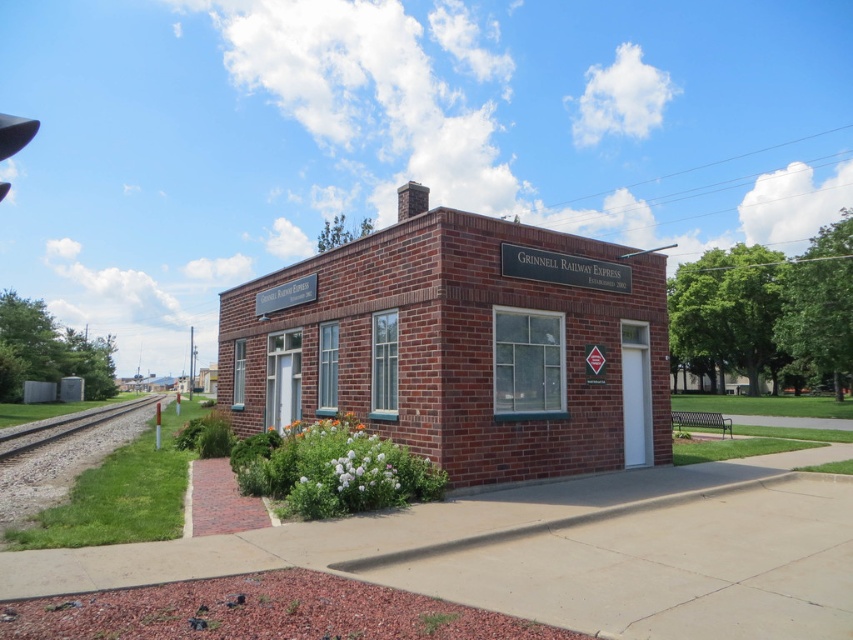
Does brick building at center appear on the left side of gray gravel train track at lower left?

In fact, brick building at center is to the right of gray gravel train track at lower left.

Can you confirm if brick building at center is positioned to the right of gray gravel train track at lower left?

Correct, you'll find brick building at center to the right of gray gravel train track at lower left.

Measure the distance between brick building at center and camera.

A distance of 30.06 feet exists between brick building at center and camera.

Locate an element on the screen. Image resolution: width=853 pixels, height=640 pixels. brick building at center is located at coordinates (461, 346).